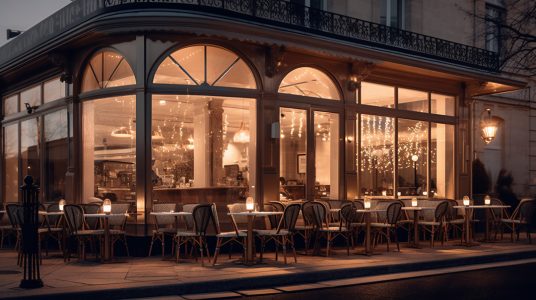
This screenshot has height=300, width=536. In order to click on 7 lit candles on the tables in this screenshot , I will do `click(57, 201)`, `click(106, 202)`, `click(245, 204)`, `click(367, 198)`, `click(411, 199)`, `click(463, 198)`, `click(489, 199)`.